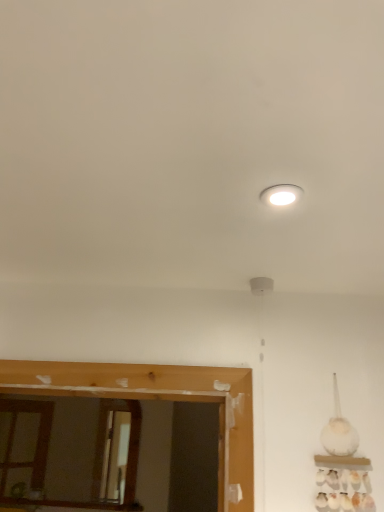
Question: Is white glossy light fixture at upper center wider than wooden mirror at lower left?

Choices:
 (A) no
 (B) yes

Answer: (B)

Question: From a real-world perspective, is white glossy light fixture at upper center located beneath wooden mirror at lower left?

Choices:
 (A) yes
 (B) no

Answer: (B)

Question: Is wooden mirror at lower left surrounded by white glossy light fixture at upper center?

Choices:
 (A) yes
 (B) no

Answer: (B)

Question: Considering the relative sizes of white glossy light fixture at upper center and wooden mirror at lower left in the image provided, is white glossy light fixture at upper center thinner than wooden mirror at lower left?

Choices:
 (A) yes
 (B) no

Answer: (B)

Question: Is white glossy light fixture at upper center at the right side of wooden mirror at lower left?

Choices:
 (A) yes
 (B) no

Answer: (A)

Question: Can you confirm if white glossy light fixture at upper center is positioned to the left of wooden mirror at lower left?

Choices:
 (A) no
 (B) yes

Answer: (A)

Question: Can you confirm if wooden mirror at lower left is positioned to the right of white glossy light fixture at upper center?

Choices:
 (A) no
 (B) yes

Answer: (A)

Question: Is wooden mirror at lower left looking in the opposite direction of white glossy light fixture at upper center?

Choices:
 (A) no
 (B) yes

Answer: (A)

Question: From the image's perspective, is wooden mirror at lower left located beneath white glossy light fixture at upper center?

Choices:
 (A) yes
 (B) no

Answer: (A)

Question: Could you tell me if wooden mirror at lower left is facing white glossy light fixture at upper center?

Choices:
 (A) no
 (B) yes

Answer: (B)

Question: Is wooden mirror at lower left closer to camera compared to white glossy light fixture at upper center?

Choices:
 (A) no
 (B) yes

Answer: (A)

Question: Considering the relative sizes of wooden mirror at lower left and white glossy light fixture at upper center in the image provided, is wooden mirror at lower left shorter than white glossy light fixture at upper center?

Choices:
 (A) no
 (B) yes

Answer: (A)

Question: Looking at their shapes, would you say wooden mirror at lower left is wider or thinner than white glossy light fixture at upper center?

Choices:
 (A) wide
 (B) thin

Answer: (B)